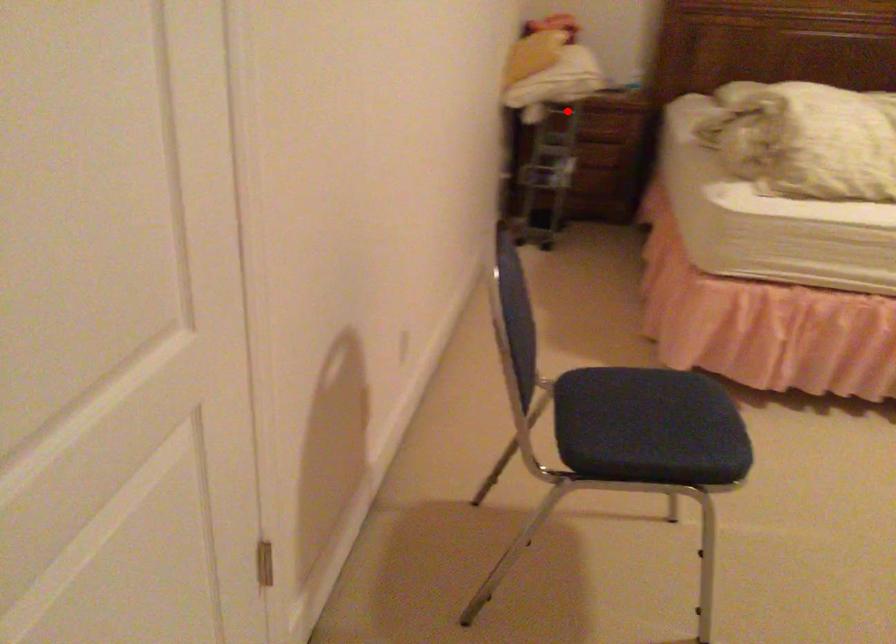
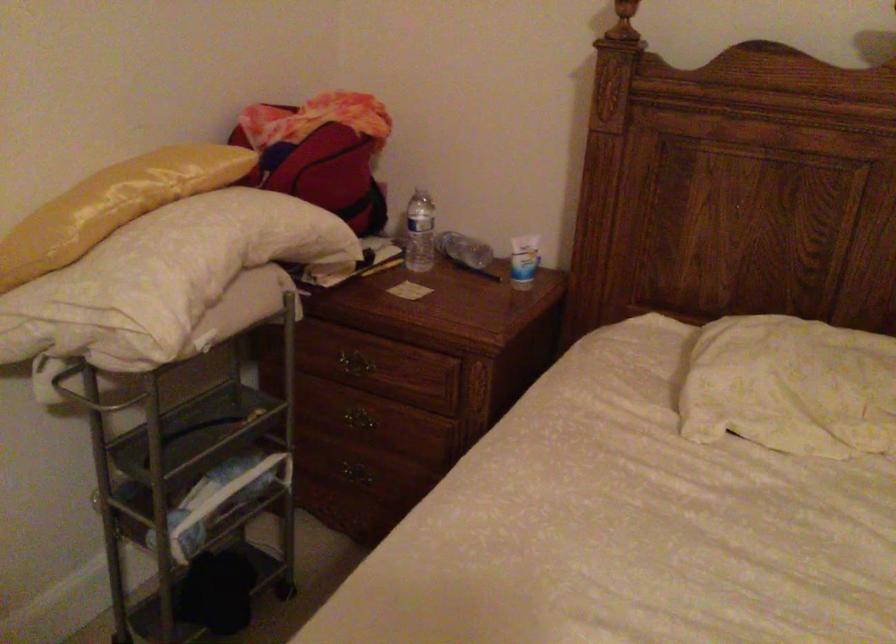
Question: I am providing you with two images of the same scene from different viewpoints. In image1, a red point is highlighted. Considering the same 3D point in image2, which of the following is correct?

Choices:
 (A) It is closer
 (B) It is farther

Answer: (A)